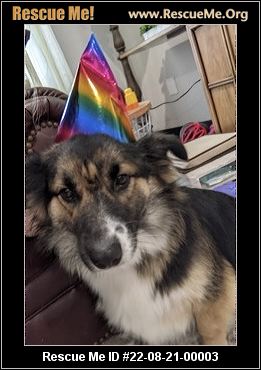
What are the coordinates of `gray wall` in the screenshot? It's located at (74, 31).